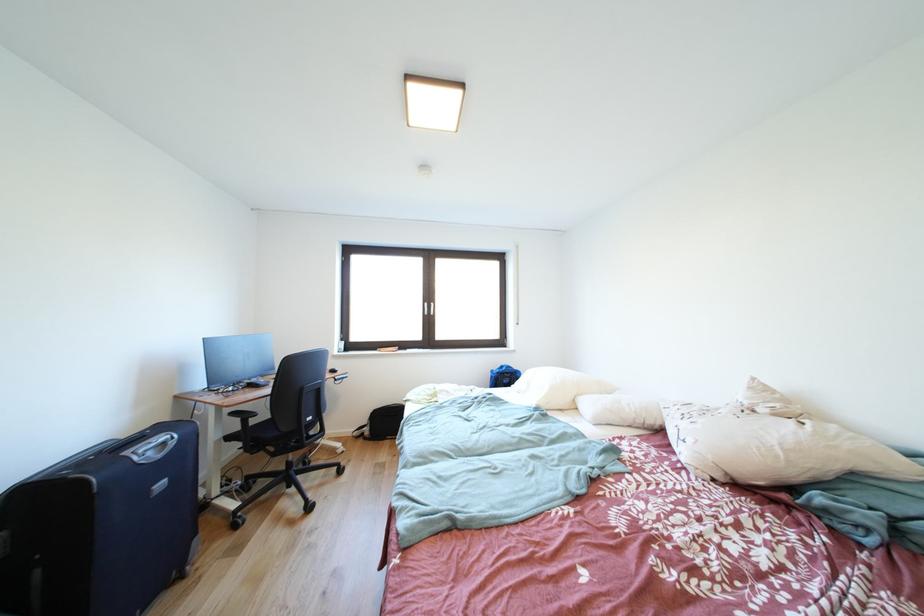
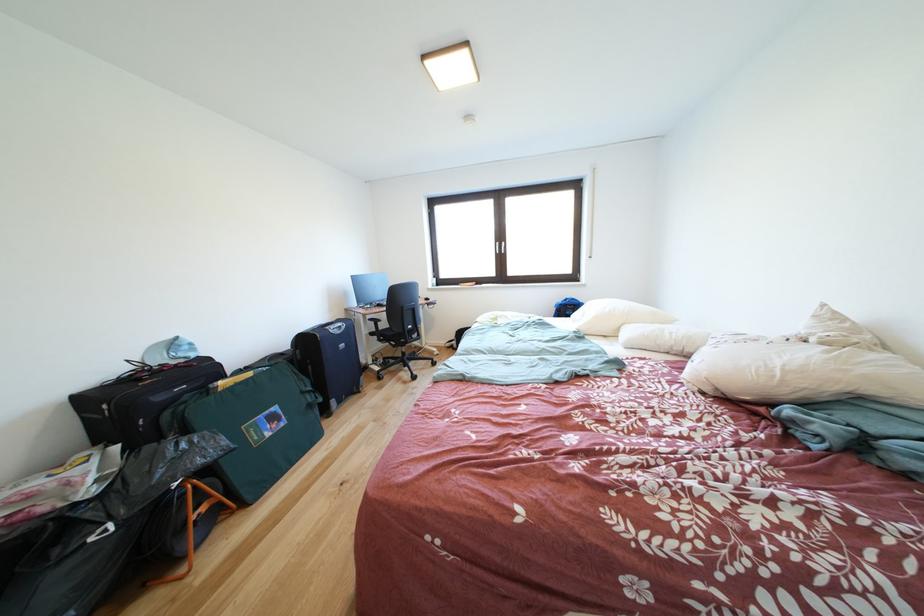
Where in the second image is the point corresponding to (516,378) from the first image?

(578, 310)